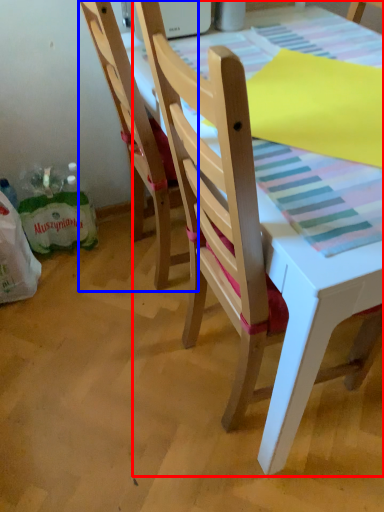
Question: Which point is further to the camera, chair (highlighted by a red box) or chair (highlighted by a blue box)?

Choices:
 (A) chair
 (B) chair

Answer: (B)